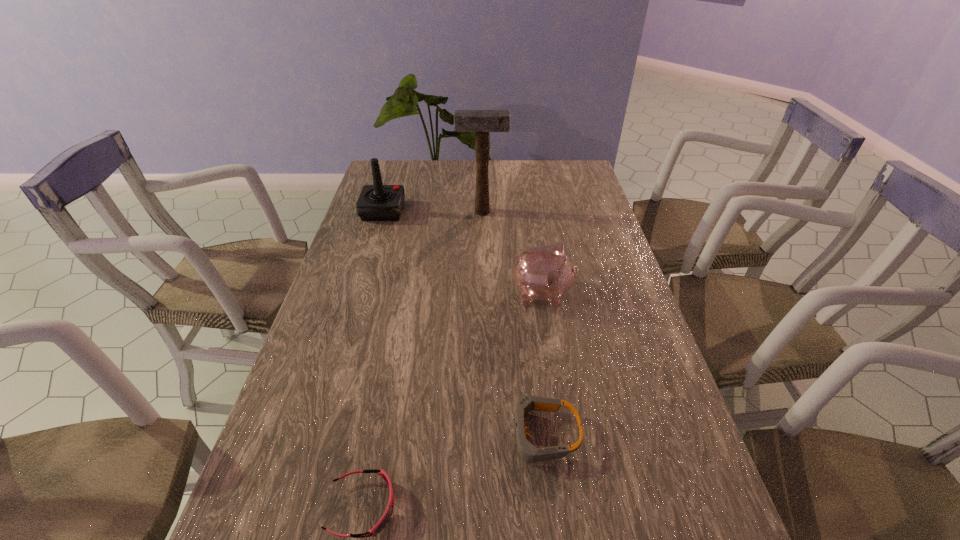
At what (x,y) coordinates should I click in order to perform the action: click on mallet. Please return your answer as a coordinate pair (x, y). This screenshot has width=960, height=540. Looking at the image, I should click on (481, 122).

Locate an element on the screen. joystick is located at coordinates (377, 202).

At what (x,y) coordinates should I click in order to perform the action: click on the third nearest object. Please return your answer as a coordinate pair (x, y). Looking at the image, I should click on (543, 273).

The image size is (960, 540). Identify the location of the third tallest object. (x=543, y=273).

Where is `the right goggles`? Image resolution: width=960 pixels, height=540 pixels. the right goggles is located at coordinates (528, 452).

Where is `the farther goggles`? This screenshot has width=960, height=540. the farther goggles is located at coordinates (528, 452).

Where is `blank area located on the back of the mallet`? Image resolution: width=960 pixels, height=540 pixels. blank area located on the back of the mallet is located at coordinates (482, 200).

You are a GUI agent. You are given a task and a screenshot of the screen. Output one action in this format:
    pyautogui.click(x=<x>, y=<y>)
    Task: Click on the free space located 0.130m on the front-facing side of the second tallest object
    
    Given the screenshot: What is the action you would take?
    pyautogui.click(x=440, y=211)

Where is `vacant area situated 0.150m on the front facing side of the third shortest object`? Image resolution: width=960 pixels, height=540 pixels. vacant area situated 0.150m on the front facing side of the third shortest object is located at coordinates (626, 294).

I want to click on free spot located 0.130m on the front and back of the right goggles, so click(x=444, y=434).